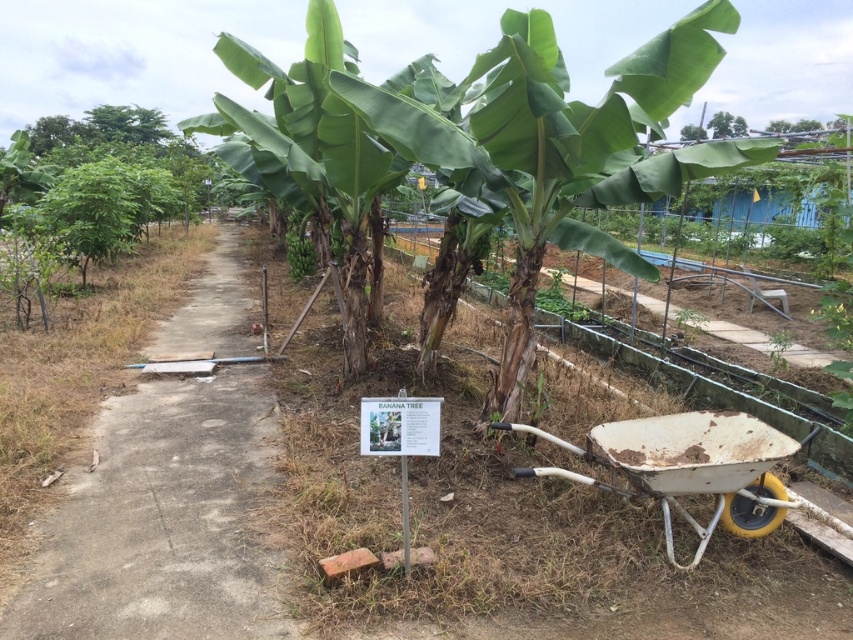
Can you confirm if dull concrete path at center is positioned below green leafy banana tree at center?

Correct, dull concrete path at center is located below green leafy banana tree at center.

Who is lower down, dull concrete path at center or green leafy banana tree at center?

dull concrete path at center

Which is behind, point (235, 470) or point (567, 221)?

Point (567, 221)

This screenshot has height=640, width=853. I want to click on dull concrete path at center, so click(x=161, y=522).

Is dull concrete path at center to the left of green leafy banana at center from the viewer's perspective?

In fact, dull concrete path at center is to the right of green leafy banana at center.

This screenshot has width=853, height=640. What do you see at coordinates (161, 522) in the screenshot?
I see `dull concrete path at center` at bounding box center [161, 522].

Is point (224, 513) closer to camera compared to point (306, 246)?

That is True.

You are a GUI agent. You are given a task and a screenshot of the screen. Output one action in this format:
    pyautogui.click(x=<x>, y=<y>)
    Task: Click on the dull concrete path at center
    
    Given the screenshot: What is the action you would take?
    pyautogui.click(x=161, y=522)

Is dull concrete path at center further to the viewer compared to white metal wheelbarrow at lower right?

Yes.

Who is taller, dull concrete path at center or white metal wheelbarrow at lower right?

Standing taller between the two is white metal wheelbarrow at lower right.

Who is more distant from viewer, [142,429] or [753,442]?

Positioned behind is point [142,429].

At what (x,y) coordinates should I click in order to perform the action: click on dull concrete path at center. Please return your answer as a coordinate pair (x, y). Looking at the image, I should click on (161, 522).